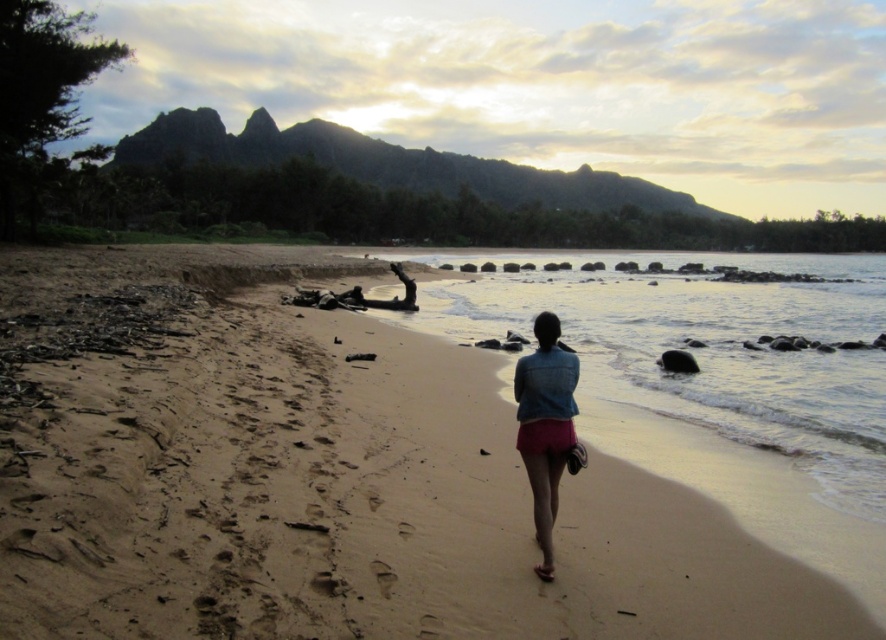
You are standing on the beach and see the sandy beach at center and the pink denim shorts at center. Which object is positioned to the left?

The sandy beach at center is to the left of the pink denim shorts at center.

You are standing on the beach and want to reach the clear water at center. According to the coordinates given, in which direction should you walk from your current position to reach it?

The clear water at center is located at coordinates point (x=706, y=348). Since the coordinate system is not specified, it is recommended to walk towards the center of the beach where the clear water is situated.